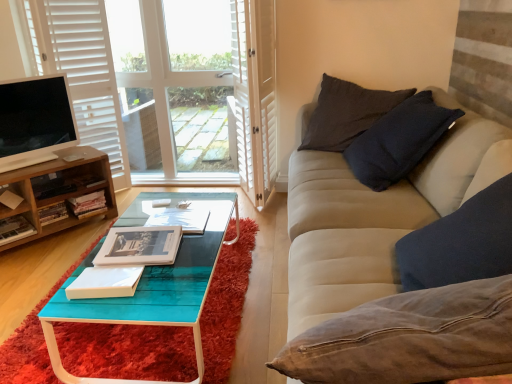
Question: From the image's perspective, is hardcover books at left, the 2th book from the back, above wooden cabinet at left?

Choices:
 (A) no
 (B) yes

Answer: (A)

Question: Is hardcover books at left, the 2th book from the back, facing away from wooden cabinet at left?

Choices:
 (A) yes
 (B) no

Answer: (A)

Question: Is hardcover books at left, the 2th book from the back, next to wooden cabinet at left and touching it?

Choices:
 (A) no
 (B) yes

Answer: (A)

Question: Does hardcover books at left, the 6th book viewed from the front, have a greater width compared to wooden cabinet at left?

Choices:
 (A) no
 (B) yes

Answer: (A)

Question: Is hardcover books at left, the 6th book viewed from the front, far from wooden cabinet at left?

Choices:
 (A) no
 (B) yes

Answer: (A)

Question: Can you confirm if hardcover books at left, the 2th book from the back, is bigger than wooden cabinet at left?

Choices:
 (A) yes
 (B) no

Answer: (B)

Question: From the image's perspective, would you say hardcover books at left, the 6th book viewed from the front, is positioned over white paper book at center, which appears as the 1th book when viewed from the front?

Choices:
 (A) yes
 (B) no

Answer: (A)

Question: Is hardcover books at left, the 6th book viewed from the front, further to the viewer compared to white paper book at center, marked as the seventh book in a back-to-front arrangement?

Choices:
 (A) yes
 (B) no

Answer: (A)

Question: Is hardcover books at left, the 6th book viewed from the front, far from white paper book at center, which appears as the 1th book when viewed from the front?

Choices:
 (A) yes
 (B) no

Answer: (A)

Question: Is hardcover books at left, the 6th book viewed from the front, touching white paper book at center, marked as the seventh book in a back-to-front arrangement?

Choices:
 (A) no
 (B) yes

Answer: (A)

Question: Is hardcover books at left, the 6th book viewed from the front, at the left side of white paper book at center, which appears as the 1th book when viewed from the front?

Choices:
 (A) no
 (B) yes

Answer: (B)

Question: Is hardcover books at left, the 2th book from the back, oriented away from white paper book at center, marked as the seventh book in a back-to-front arrangement?

Choices:
 (A) yes
 (B) no

Answer: (B)

Question: Is hardcover book at center, the 7th book from the front, looking in the opposite direction of hardcover book at center, the third book when ordered from front to back?

Choices:
 (A) yes
 (B) no

Answer: (B)